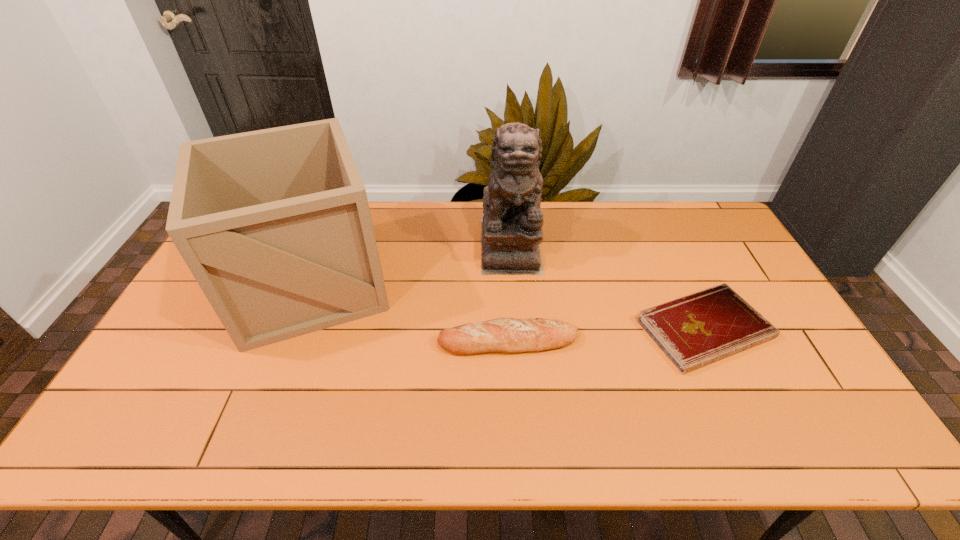
The height and width of the screenshot is (540, 960). I want to click on empty space between the sculpture and the notebook, so click(608, 286).

Image resolution: width=960 pixels, height=540 pixels. I want to click on vacant region between the sculpture and the leftmost object, so (410, 263).

In order to click on free area in between the sculpture and the rightmost object in this screenshot , I will do `click(608, 286)`.

The image size is (960, 540). Find the location of `vacant space in between the third tallest object and the rightmost object`. vacant space in between the third tallest object and the rightmost object is located at coordinates (607, 335).

The height and width of the screenshot is (540, 960). In order to click on unoccupied area between the baguet and the sculpture in this screenshot , I will do `click(510, 292)`.

The width and height of the screenshot is (960, 540). What are the coordinates of `free space between the second shortest object and the sculpture` in the screenshot? It's located at (510, 292).

Where is `vacant area that lies between the sculpture and the box`? Image resolution: width=960 pixels, height=540 pixels. vacant area that lies between the sculpture and the box is located at coordinates (410, 263).

Locate an element on the screen. The image size is (960, 540). unoccupied area between the baguet and the leftmost object is located at coordinates (409, 312).

Where is `object that is the second closest one to the notebook`? object that is the second closest one to the notebook is located at coordinates (512, 222).

Identify which object is the closest to the rightmost object. Please provide its 2D coordinates. Your answer should be formatted as a tuple, i.e. [(x, y)], where the tuple contains the x and y coordinates of a point satisfying the conditions above.

[(503, 335)]